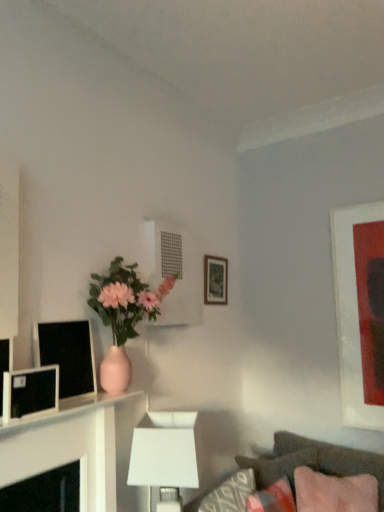
Image resolution: width=384 pixels, height=512 pixels. What are the coordinates of `matte pink vase at center` in the screenshot? It's located at (123, 315).

This screenshot has width=384, height=512. Identify the location of matte white picture frame at right, arranged as the 2th picture frame when viewed from the back. (360, 311).

Find the location of a particular element. The image size is (384, 512). matte wooden picture frame at center, the 1th picture frame positioned from the left is located at coordinates (215, 280).

Image resolution: width=384 pixels, height=512 pixels. Identify the location of pink fabric pillow at lower right, the 2th pillow viewed from the front. (279, 465).

The height and width of the screenshot is (512, 384). Describe the element at coordinates (279, 465) in the screenshot. I see `pink fabric pillow at lower right, the 2th pillow viewed from the front` at that location.

Describe the element at coordinates (335, 492) in the screenshot. This screenshot has height=512, width=384. I see `pink fabric pillow at lower right, which ranks as the 2th pillow in back-to-front order` at that location.

Image resolution: width=384 pixels, height=512 pixels. What do you see at coordinates (30, 394) in the screenshot?
I see `matte black monitor at left, the second computer monitor viewed from the back` at bounding box center [30, 394].

Locate an element on the screen. Image resolution: width=384 pixels, height=512 pixels. matte black monitor at left, the 1th computer monitor viewed from the front is located at coordinates (30, 394).

This screenshot has height=512, width=384. What are the coordinates of `white glossy table at upper left` in the screenshot? It's located at (78, 446).

Considering the sizes of matte pink vase at center and matte black monitor at left, which ranks as the 1th computer monitor in back-to-front order, in the image, is matte pink vase at center wider or thinner than matte black monitor at left, which ranks as the 1th computer monitor in back-to-front order,?

In the image, matte pink vase at center appears to be wider than matte black monitor at left, which ranks as the 1th computer monitor in back-to-front order.

This screenshot has width=384, height=512. I want to click on computer monitor that is the 1st one when counting leftward from the matte pink vase at center, so click(67, 356).

Would you say matte pink vase at center is a long distance from matte black monitor at left, the second computer monitor in the front-to-back sequence?

matte pink vase at center is near matte black monitor at left, the second computer monitor in the front-to-back sequence, not far away.

Who is shorter, matte pink vase at center or matte black monitor at left, which ranks as the 1th computer monitor in back-to-front order?

matte black monitor at left, which ranks as the 1th computer monitor in back-to-front order.

Who is shorter, matte black monitor at left, the second computer monitor viewed from the back, or matte pink vase at center?

Standing shorter between the two is matte black monitor at left, the second computer monitor viewed from the back.

From the image's perspective, does matte black monitor at left, the 1th computer monitor viewed from the front, appear lower than matte pink vase at center?

Indeed, from the image's perspective, matte black monitor at left, the 1th computer monitor viewed from the front, is shown beneath matte pink vase at center.

How far apart are matte black monitor at left, the 1th computer monitor viewed from the front, and matte pink vase at center?

20.23 inches.

Considering the relative positions of matte black monitor at left, the second computer monitor viewed from the back, and matte pink vase at center in the image provided, is matte black monitor at left, the second computer monitor viewed from the back, to the right of matte pink vase at center from the viewer's perspective?

No, matte black monitor at left, the second computer monitor viewed from the back, is not to the right of matte pink vase at center.

Is matte white picture frame at right, arranged as the 2th picture frame when viewed from the back, at the back of pink fabric pillow at lower right, which ranks as the 2th pillow in back-to-front order?

pink fabric pillow at lower right, which ranks as the 2th pillow in back-to-front order, is not turned away from matte white picture frame at right, arranged as the 2th picture frame when viewed from the back.

Based on their sizes in the image, would you say pink fabric pillow at lower right, the 1th pillow in the front-to-back sequence, is bigger or smaller than matte white picture frame at right, which is the 2th picture frame in left-to-right order?

Clearly, pink fabric pillow at lower right, the 1th pillow in the front-to-back sequence, is larger in size than matte white picture frame at right, which is the 2th picture frame in left-to-right order.

Between point (334, 508) and point (379, 229), which one is positioned behind?

The point (379, 229) is farther from the camera.

You are a GUI agent. You are given a task and a screenshot of the screen. Output one action in this format:
    pyautogui.click(x=<x>, y=<y>)
    Task: Click on the picture frame that is the 1st object located above the pink fabric pillow at lower right, the 1th pillow in the front-to-back sequence (from the image's perspective)
    
    Given the screenshot: What is the action you would take?
    pyautogui.click(x=360, y=311)

Is matte wooden picture frame at center, the 1th picture frame positioned from the left, facing towards pink fabric pillow at lower right, acting as the first pillow starting from the back?

No, matte wooden picture frame at center, the 1th picture frame positioned from the left, is not turned towards pink fabric pillow at lower right, acting as the first pillow starting from the back.

You are a GUI agent. You are given a task and a screenshot of the screen. Output one action in this format:
    pyautogui.click(x=<x>, y=<y>)
    Task: Click on the 2nd picture frame behind the pink fabric pillow at lower right, the 2th pillow viewed from the front
    The image size is (384, 512).
    Given the screenshot: What is the action you would take?
    pyautogui.click(x=215, y=280)

Consider the image. Between matte wooden picture frame at center, which is the 2th picture frame from front to back, and pink fabric pillow at lower right, the 2th pillow viewed from the front, which one has larger size?

Bigger between the two is pink fabric pillow at lower right, the 2th pillow viewed from the front.

In the image, is matte wooden picture frame at center, placed as the 1th picture frame when sorted from back to front, positioned in front of or behind pink fabric pillow at lower right, the 2th pillow viewed from the front?

matte wooden picture frame at center, placed as the 1th picture frame when sorted from back to front, is positioned farther from the viewer than pink fabric pillow at lower right, the 2th pillow viewed from the front.

Which point is more forward, (226, 281) or (331, 503)?

Positioned in front is point (331, 503).

From the image's perspective, is matte wooden picture frame at center, which is the 2th picture frame from front to back, under pink fabric pillow at lower right, which ranks as the 2th pillow in back-to-front order?

No.

Is matte wooden picture frame at center, the 1th picture frame positioned from the left, bigger than pink fabric pillow at lower right, the 1th pillow in the front-to-back sequence?

No.

How distant is matte wooden picture frame at center, placed as the 1th picture frame when sorted from back to front, from pink fabric pillow at lower right, which ranks as the 2th pillow in back-to-front order?

A distance of 4.29 feet exists between matte wooden picture frame at center, placed as the 1th picture frame when sorted from back to front, and pink fabric pillow at lower right, which ranks as the 2th pillow in back-to-front order.

In terms of size, does pink fabric pillow at lower right, the 1th pillow in the front-to-back sequence, appear bigger or smaller than matte black monitor at left, the second computer monitor in the front-to-back sequence?

Considering their sizes, pink fabric pillow at lower right, the 1th pillow in the front-to-back sequence, takes up more space than matte black monitor at left, the second computer monitor in the front-to-back sequence.

Considering the sizes of objects pink fabric pillow at lower right, the 1th pillow in the front-to-back sequence, and matte black monitor at left, which ranks as the 1th computer monitor in back-to-front order, in the image provided, who is thinner, pink fabric pillow at lower right, the 1th pillow in the front-to-back sequence, or matte black monitor at left, which ranks as the 1th computer monitor in back-to-front order,?

matte black monitor at left, which ranks as the 1th computer monitor in back-to-front order.

Consider the image. From the image's perspective, who appears lower, pink fabric pillow at lower right, the 1th pillow in the front-to-back sequence, or matte black monitor at left, the second computer monitor in the front-to-back sequence?

pink fabric pillow at lower right, the 1th pillow in the front-to-back sequence.

Based on the photo, is matte black monitor at left, the 1th computer monitor viewed from the front, in front of pink fabric pillow at lower right, the 1th pillow in the front-to-back sequence?

Yes, matte black monitor at left, the 1th computer monitor viewed from the front, is in front of pink fabric pillow at lower right, the 1th pillow in the front-to-back sequence.

Can you confirm if matte black monitor at left, the 1th computer monitor viewed from the front, is taller than pink fabric pillow at lower right, which ranks as the 2th pillow in back-to-front order?

No, matte black monitor at left, the 1th computer monitor viewed from the front, is not taller than pink fabric pillow at lower right, which ranks as the 2th pillow in back-to-front order.

From a real-world perspective, does matte black monitor at left, the second computer monitor viewed from the back, sit lower than pink fabric pillow at lower right, which ranks as the 2th pillow in back-to-front order?

No.

Is matte black monitor at left, the 1th computer monitor viewed from the front, completely or partially outside of pink fabric pillow at lower right, which ranks as the 2th pillow in back-to-front order?

Absolutely, matte black monitor at left, the 1th computer monitor viewed from the front, is external to pink fabric pillow at lower right, which ranks as the 2th pillow in back-to-front order.

From a real-world perspective, count 1st computer monitors downward from the matte pink vase at center and point to it. Please provide its 2D coordinates.

[(67, 356)]

Locate an element on the screen. This screenshot has width=384, height=512. the 2nd computer monitor below when counting from the matte pink vase at center (from the image's perspective) is located at coordinates (30, 394).

Which object lies nearer to the anchor point pink fabric pillow at lower right, which ranks as the 2th pillow in back-to-front order, velvet brown couch at lower right or matte black monitor at left, the 1th computer monitor viewed from the front?

Based on the image, velvet brown couch at lower right appears to be nearer to pink fabric pillow at lower right, which ranks as the 2th pillow in back-to-front order.

From the image, which object appears to be farther from matte black monitor at left, the second computer monitor viewed from the back, matte white picture frame at right, arranged as the 2th picture frame when viewed from the back, or matte pink vase at center?

matte white picture frame at right, arranged as the 2th picture frame when viewed from the back, is positioned further to the anchor matte black monitor at left, the second computer monitor viewed from the back.

Which object lies nearer to the anchor point white matte table lamp at lower center, matte black monitor at left, the second computer monitor in the front-to-back sequence, or pink fabric pillow at lower right, the 2th pillow viewed from the front?

Based on the image, matte black monitor at left, the second computer monitor in the front-to-back sequence, appears to be nearer to white matte table lamp at lower center.

Which object lies further to the anchor point white glossy table at upper left, matte pink vase at center or matte black monitor at left, the second computer monitor viewed from the back?

matte pink vase at center.

Based on their spatial positions, is pink fabric pillow at lower right, the 1th pillow in the front-to-back sequence, or matte black monitor at left, which ranks as the 1th computer monitor in back-to-front order, closer to white glossy table at upper left?

matte black monitor at left, which ranks as the 1th computer monitor in back-to-front order, lies closer to white glossy table at upper left than the other object.

From the image, which object appears to be farther from matte white picture frame at right, which is the 2th picture frame in left-to-right order, white glossy table at upper left or pink fabric pillow at lower right, the 1th pillow in the front-to-back sequence?

white glossy table at upper left is positioned further to the anchor matte white picture frame at right, which is the 2th picture frame in left-to-right order.

Which object lies nearer to the anchor point white glossy table at upper left, pink fabric pillow at lower right, which ranks as the 2th pillow in back-to-front order, or pink fabric pillow at lower right, the 2th pillow viewed from the front?

Based on the image, pink fabric pillow at lower right, the 2th pillow viewed from the front, appears to be nearer to white glossy table at upper left.

Considering their positions, is matte black monitor at left, which ranks as the 1th computer monitor in back-to-front order, positioned further to white glossy table at upper left than pink fabric pillow at lower right, the 2th pillow viewed from the front?

Among the two, pink fabric pillow at lower right, the 2th pillow viewed from the front, is located further to white glossy table at upper left.

Locate an element on the screen. This screenshot has width=384, height=512. studio couch between matte pink vase at center and matte white picture frame at right, arranged as the 2th picture frame when viewed from the back is located at coordinates (312, 461).

This screenshot has width=384, height=512. Find the location of `computer monitor between matte black monitor at left, the 1th computer monitor viewed from the front, and matte wooden picture frame at center, placed as the second picture frame when sorted from right to left, from front to back`. computer monitor between matte black monitor at left, the 1th computer monitor viewed from the front, and matte wooden picture frame at center, placed as the second picture frame when sorted from right to left, from front to back is located at coordinates (67, 356).

The image size is (384, 512). In order to click on houseplant between matte black monitor at left, the second computer monitor in the front-to-back sequence, and velvet brown couch at lower right, in the horizontal direction in this screenshot , I will do `click(123, 315)`.

Where is `houseplant between matte black monitor at left, which ranks as the 1th computer monitor in back-to-front order, and pink fabric pillow at lower right, acting as the first pillow starting from the back`? houseplant between matte black monitor at left, which ranks as the 1th computer monitor in back-to-front order, and pink fabric pillow at lower right, acting as the first pillow starting from the back is located at coordinates tap(123, 315).